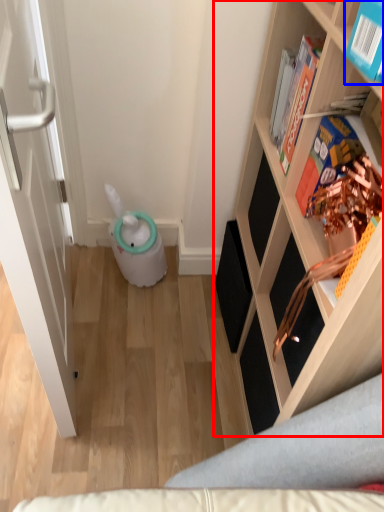
Question: Which object appears farthest to the camera in this image, shelf (highlighted by a red box) or book (highlighted by a blue box)?

Choices:
 (A) shelf
 (B) book

Answer: (B)